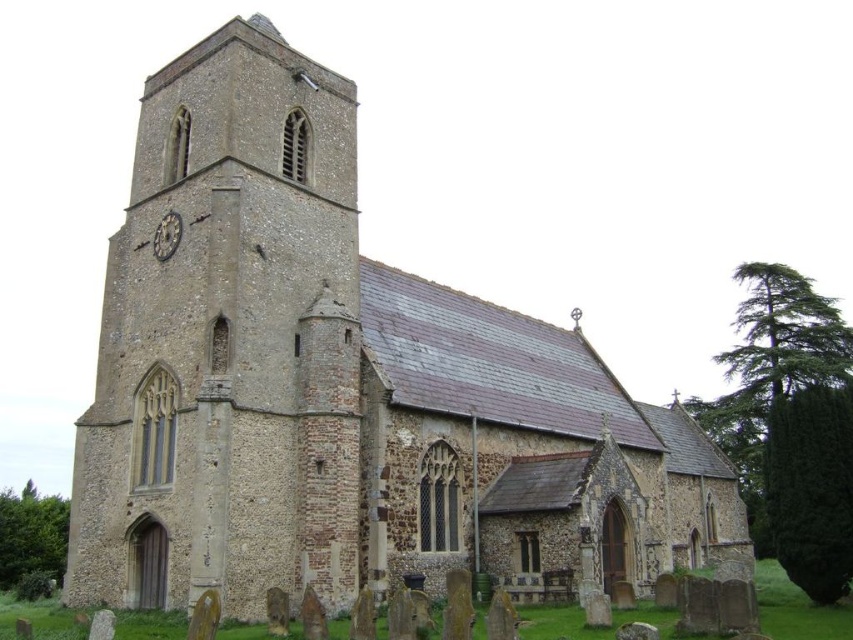
Is point (308, 144) in front of point (160, 224)?

No, (308, 144) is behind (160, 224).

Does brown stone tower at left appear over dark gray stone clock at upper left?

No.

Locate an element on the screen. The height and width of the screenshot is (640, 853). brown stone tower at left is located at coordinates (228, 342).

Where is `brown stone tower at left`? brown stone tower at left is located at coordinates tap(228, 342).